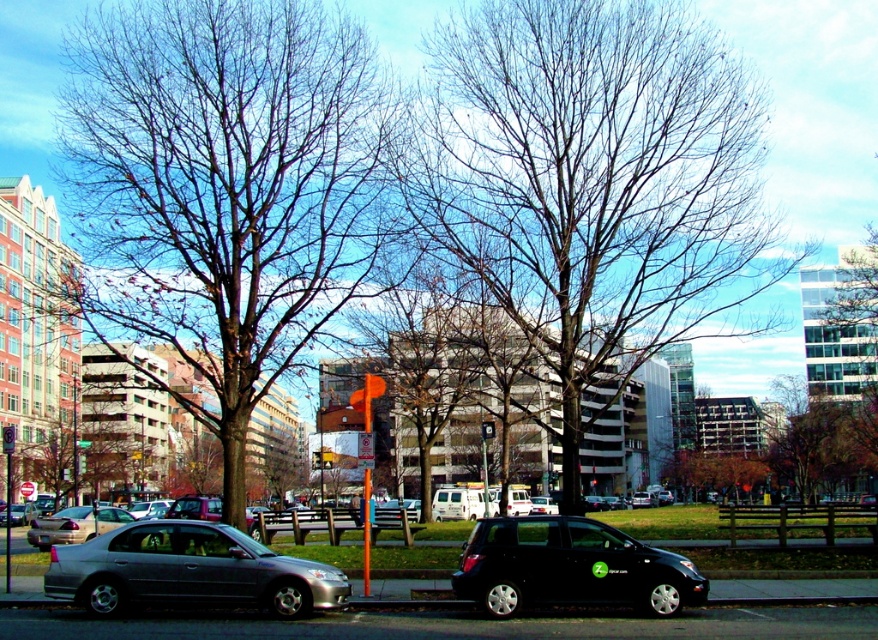
Question: Among these objects, which one is nearest to the camera?

Choices:
 (A) metallic gray sedan at lower left
 (B) black glossy hatchback at center
 (C) green leafy tree at upper right
 (D) bare branches at center

Answer: (A)

Question: Does bare wood tree at center lie in front of silver metallic sedan at center?

Choices:
 (A) yes
 (B) no

Answer: (A)

Question: Does bare branches at center lie behind bare wood tree at center?

Choices:
 (A) yes
 (B) no

Answer: (A)

Question: Which point is farther from the camera taking this photo?

Choices:
 (A) (156, 80)
 (B) (217, 550)

Answer: (A)

Question: Among these objects, which one is farthest from the camera?

Choices:
 (A) green leafy tree at upper right
 (B) bare wood tree at center
 (C) silver metallic sedan at center
 (D) metallic gray sedan at lower left

Answer: (C)

Question: Does metallic gray sedan at lower left have a greater width compared to silver metallic sedan at center?

Choices:
 (A) yes
 (B) no

Answer: (B)